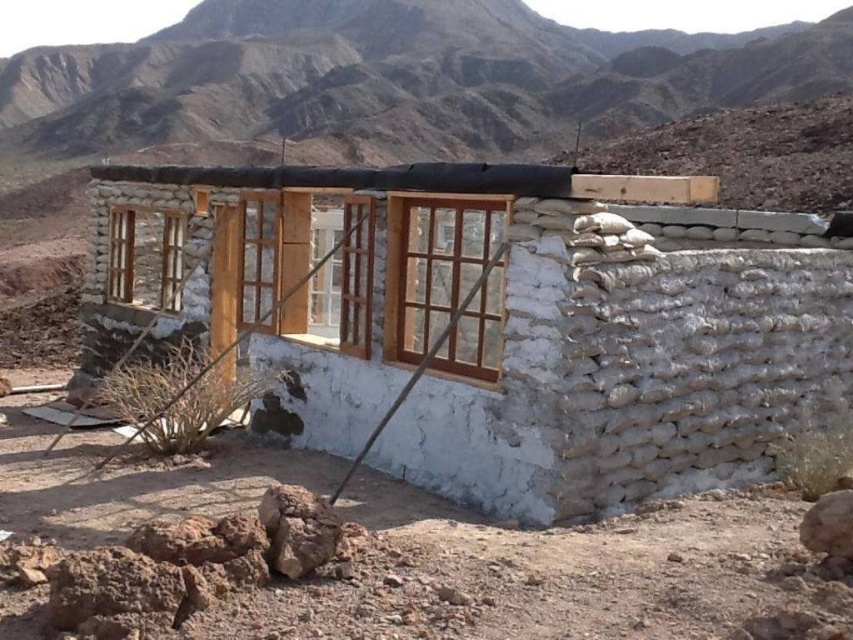
You are an architect evaluating the structural integrity of the building. You notice two wooden frames, the wooden frame at left and the wooden frame at center. Which of these two wooden frames has a greater width?

The wooden frame at left has a greater width than the wooden frame at center according to the description.

You are standing in front of the partially constructed adobe building. There are two points marked on the structure. The first point is at coordinates point (x=445, y=362) and the second point is at point (x=247, y=212). Which point is closer to you?

Point (x=445, y=362) is closer to the camera than point (x=247, y=212), so the first point is closer to you.